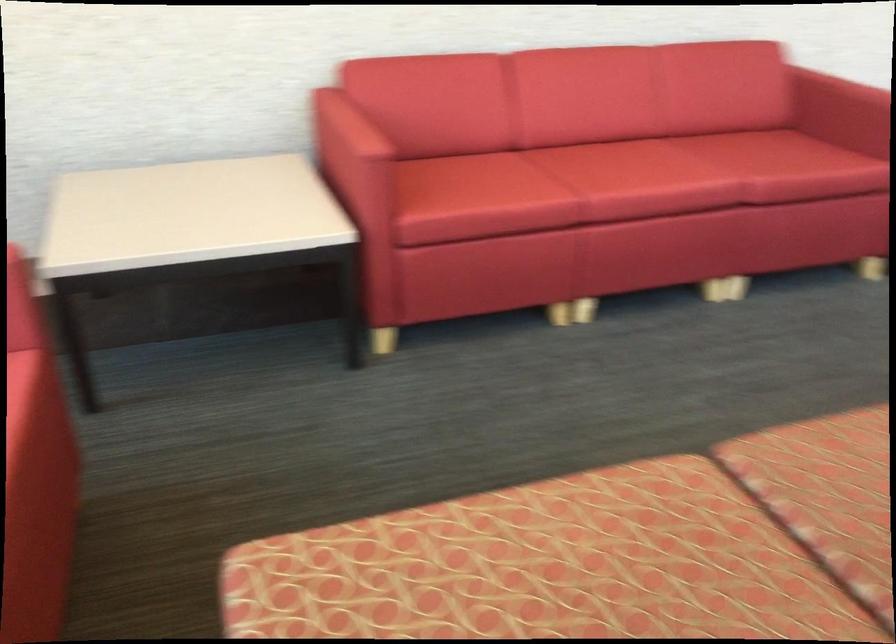
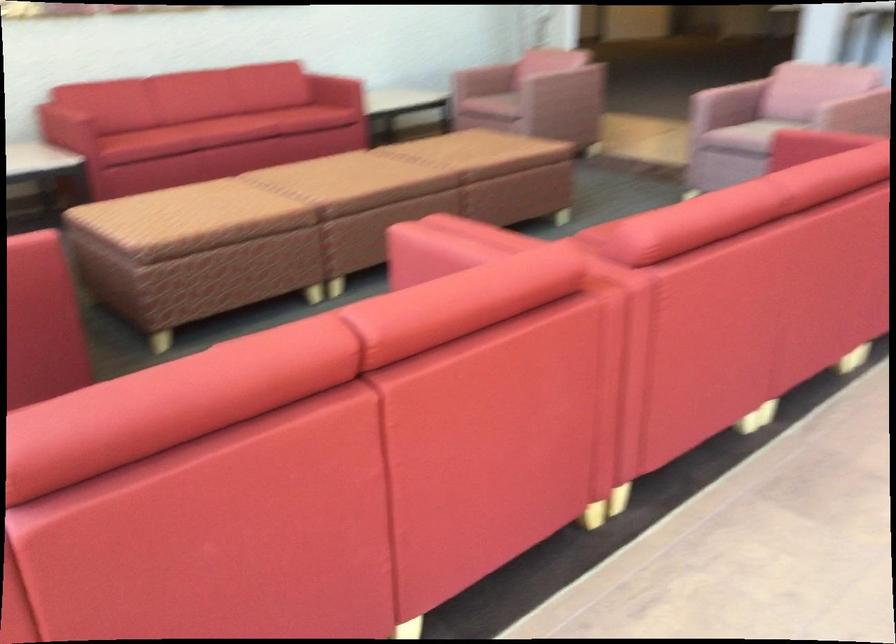
Question: What movement of the cameraman would produce the second image?

Choices:
 (A) Left
 (B) Right
 (C) Forward
 (D) Backward

Answer: (D)